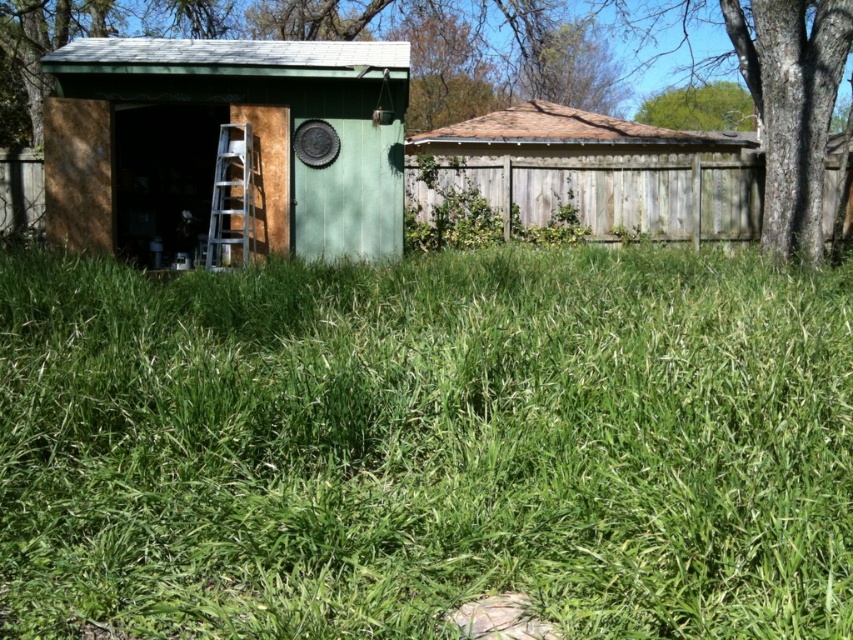
Question: Does green grassy at center appear over green painted wood shed at center?

Choices:
 (A) no
 (B) yes

Answer: (A)

Question: Which of the following is the farthest from the observer?

Choices:
 (A) green grassy at center
 (B) green wood tree at upper center
 (C) silver metallic ladder at center
 (D) weathered wood fence at upper center

Answer: (D)

Question: Observing the image, what is the correct spatial positioning of green grassy at center in reference to green wood tree at upper center?

Choices:
 (A) above
 (B) below

Answer: (B)

Question: Can you confirm if green painted wood shed at center is positioned to the left of green leafy tree at upper center?

Choices:
 (A) yes
 (B) no

Answer: (A)

Question: Which point is farther to the camera?

Choices:
 (A) green grassy at center
 (B) green painted wood shed at center
 (C) green leafy tree at upper center

Answer: (C)

Question: Which object appears closest to the camera in this image?

Choices:
 (A) green wood tree at upper center
 (B) green leafy tree at upper center
 (C) green grassy at center

Answer: (C)